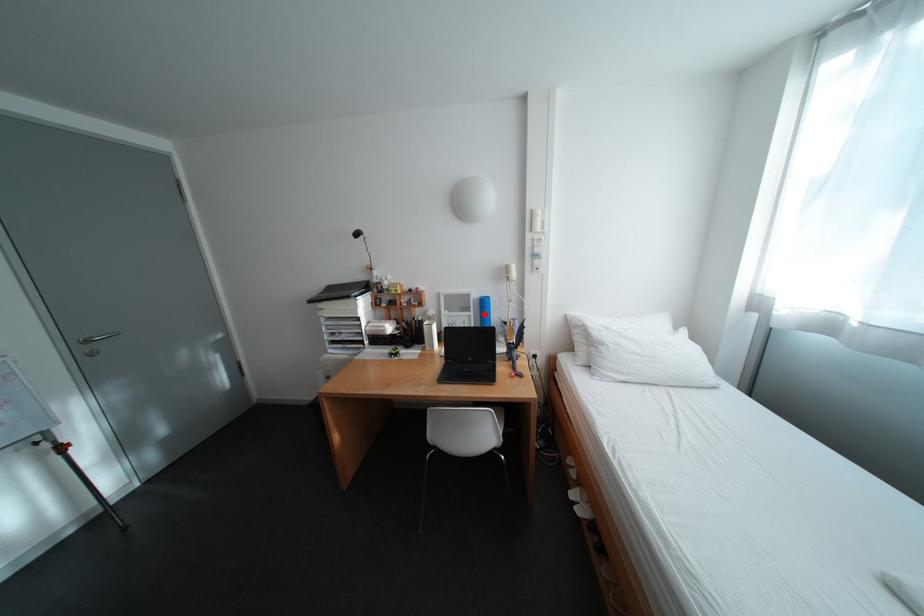
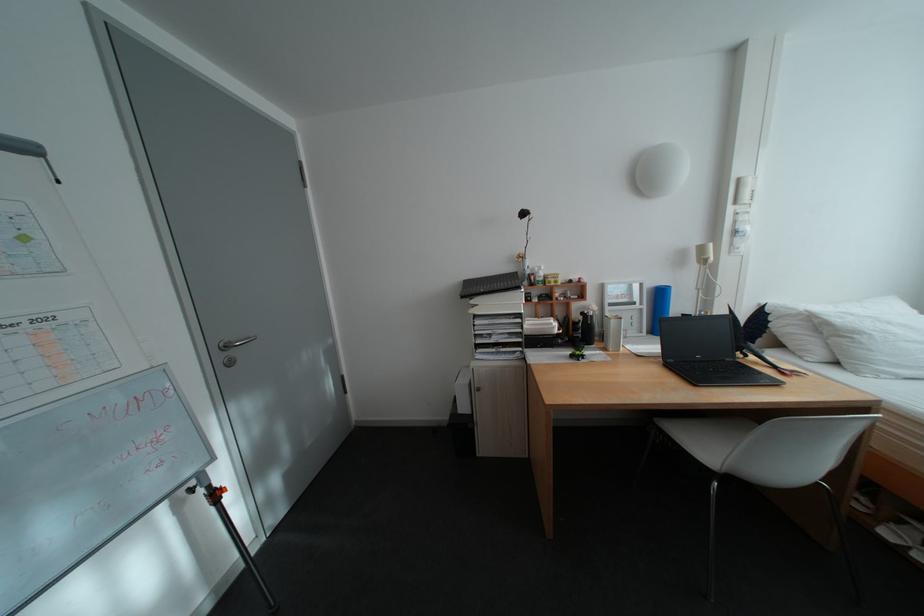
Question: I am providing you with two images of the same scene from different viewpoints. A red point is marked on the first image. At the location where the point appears in image 1, is it still visible in image 2?

Choices:
 (A) Yes
 (B) No

Answer: (A)